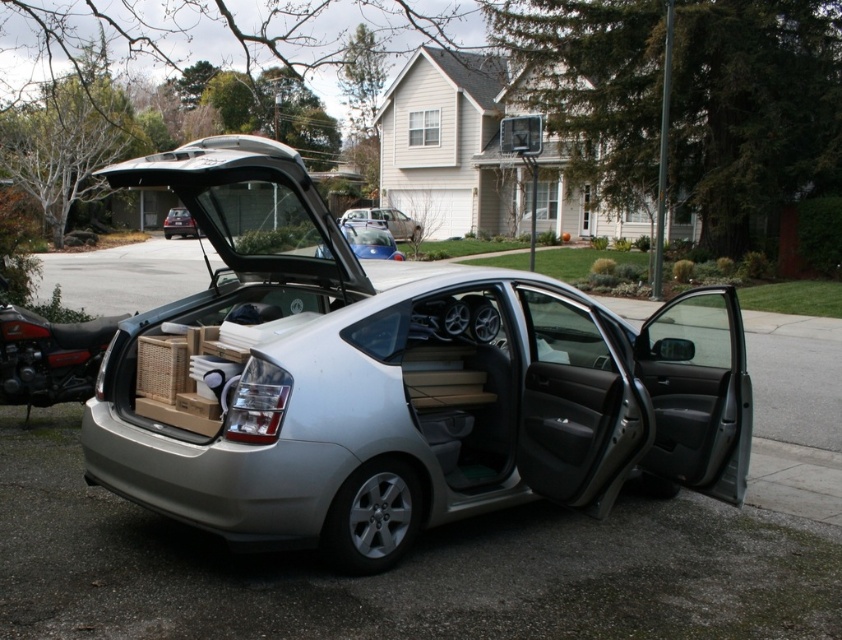
Who is more forward, (x=246, y=182) or (x=349, y=232)?

Point (x=246, y=182) is in front.

Who is more forward, (529, 458) or (365, 234)?

Point (529, 458) is more forward.

The height and width of the screenshot is (640, 842). I want to click on satin silver sedan at center, so click(x=392, y=381).

Is satin silver sedan at center wider than matte black car at center?

Correct, the width of satin silver sedan at center exceeds that of matte black car at center.

Is point (211, 241) behind point (193, 227)?

That is False.

Does point (177, 164) lie behind point (172, 230)?

No, (177, 164) is in front of (172, 230).

Identify the location of satin silver sedan at center. Image resolution: width=842 pixels, height=640 pixels. (392, 381).

Between satin blue sedan at center and matte black car at center, which one appears on the left side from the viewer's perspective?

From the viewer's perspective, matte black car at center appears more on the left side.

Looking at this image, does satin blue sedan at center appear on the right side of matte black car at center?

Yes, satin blue sedan at center is to the right of matte black car at center.

Is point (368, 225) closer to camera compared to point (173, 218)?

Yes, point (368, 225) is closer to viewer.

Image resolution: width=842 pixels, height=640 pixels. In order to click on satin blue sedan at center in this screenshot , I will do `click(370, 241)`.